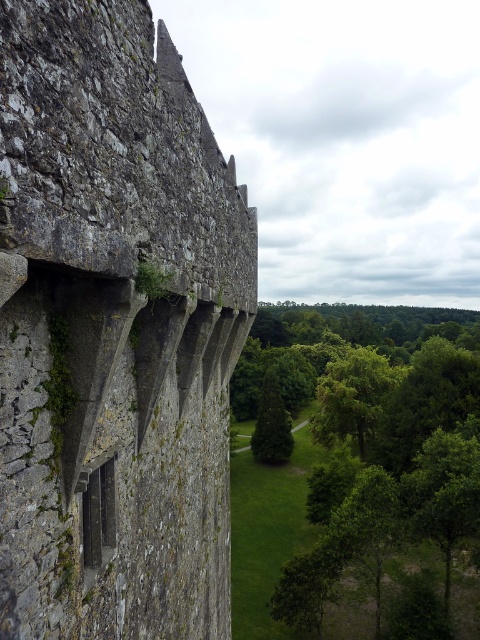
You are a bird flying over the landscape and want to land on the highest point between the rough stone wall at left and the green leafy tree at center. Which one should you choose?

The green leafy tree at center is taller than the rough stone wall at left, so you should land on the green leafy tree at center to reach the highest point.

You are standing at the top of a hill overlooking the rough stone wall at left and the green leafy tree at center. Which object is closer to you?

The rough stone wall at left is closer to the viewer than the green leafy tree at center.

You are standing at the center of the image. Which direction should you walk to reach the rough stone wall at left?

You should walk to the left to reach the rough stone wall at left since it is located at the left side of the image.